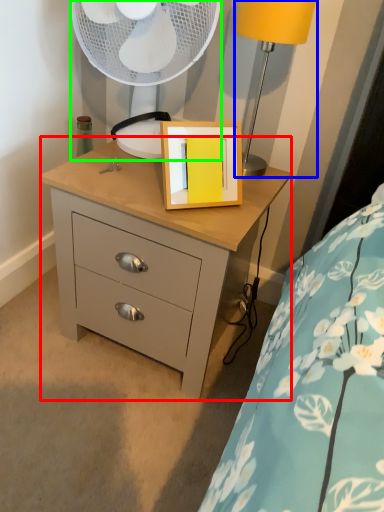
Question: Which is nearer to the chest of drawers (highlighted by a red box)? table lamp (highlighted by a blue box) or mechanical fan (highlighted by a green box).

Choices:
 (A) table lamp
 (B) mechanical fan

Answer: (B)